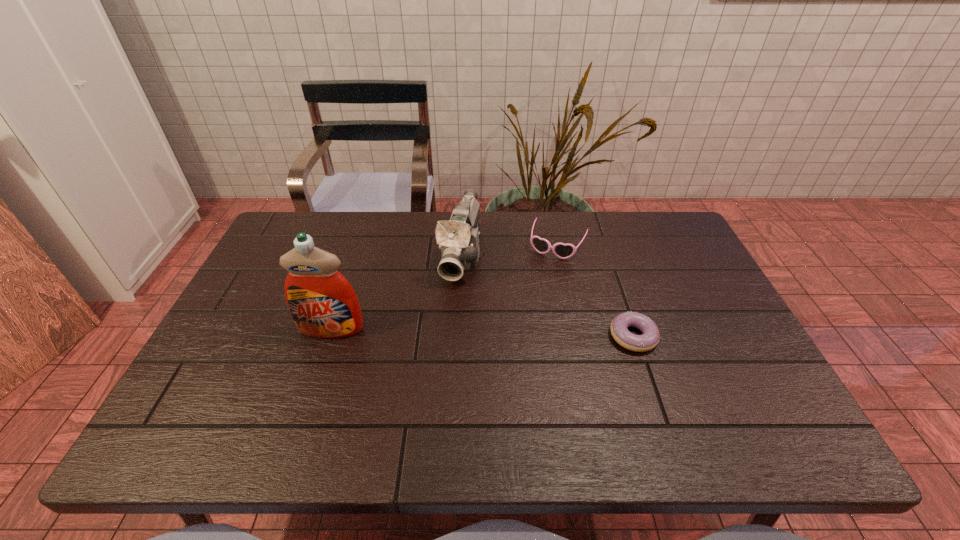
This screenshot has height=540, width=960. What are the coordinates of `free space located 0.140m on the front-facing side of the sunglasses` in the screenshot? It's located at (535, 290).

Find the location of `vacant point located on the front-facing side of the third object from right to left`. vacant point located on the front-facing side of the third object from right to left is located at coordinates (433, 361).

Locate an element on the screen. Image resolution: width=960 pixels, height=540 pixels. free space located 0.170m on the front-facing side of the third object from right to left is located at coordinates (442, 333).

The width and height of the screenshot is (960, 540). I want to click on free space located on the front-facing side of the third object from right to left, so click(431, 368).

You are a GUI agent. You are given a task and a screenshot of the screen. Output one action in this format:
    pyautogui.click(x=<x>, y=<y>)
    Task: Click on the sunglasses that is at the far edge
    The width and height of the screenshot is (960, 540).
    Given the screenshot: What is the action you would take?
    pyautogui.click(x=563, y=251)

Locate an element on the screen. camcorder at the far edge is located at coordinates (458, 239).

I want to click on vacant area at the far edge, so click(x=377, y=220).

Find the location of a particular element. The width and height of the screenshot is (960, 540). free region at the near edge of the desktop is located at coordinates (682, 403).

This screenshot has width=960, height=540. In order to click on vacant area at the left edge of the desktop in this screenshot , I will do `click(267, 301)`.

Image resolution: width=960 pixels, height=540 pixels. Identify the location of vacant space at the right edge of the desktop. (696, 330).